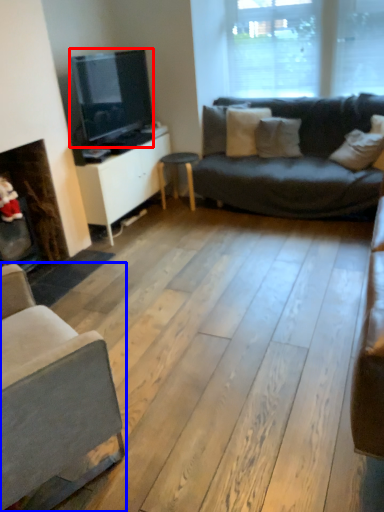
Question: Which point is closer to the camera, television (highlighted by a red box) or studio couch (highlighted by a blue box)?

Choices:
 (A) television
 (B) studio couch

Answer: (B)